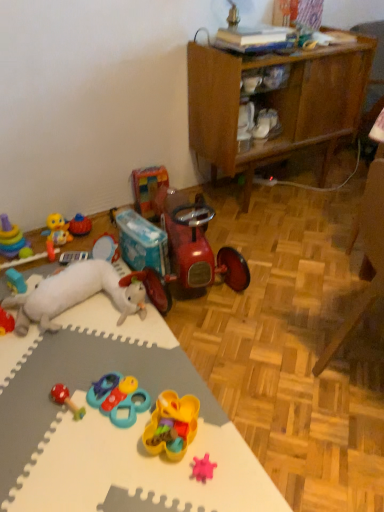
This screenshot has height=512, width=384. I want to click on free area behind translucent yellow plastic toy at center, the second toy in the right-to-left sequence, so click(173, 373).